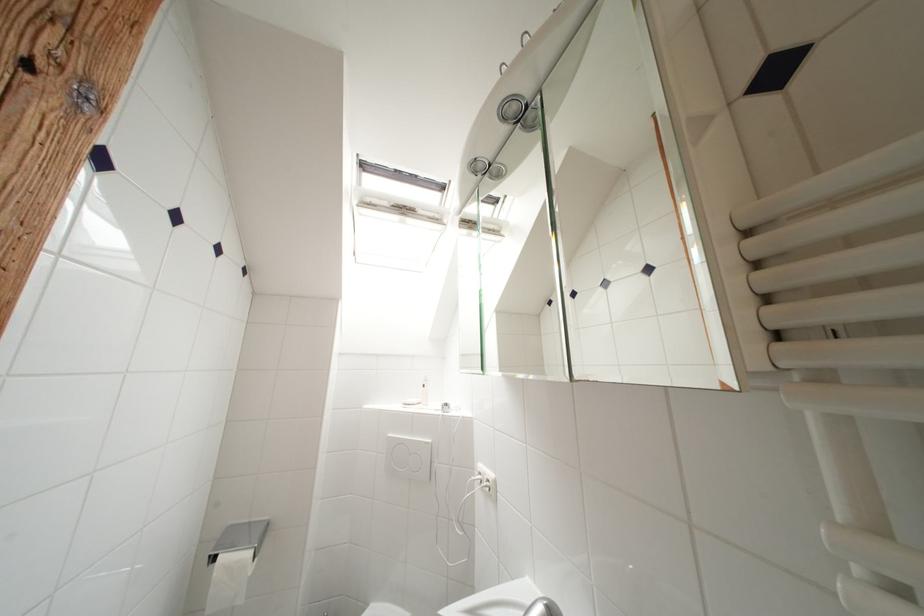
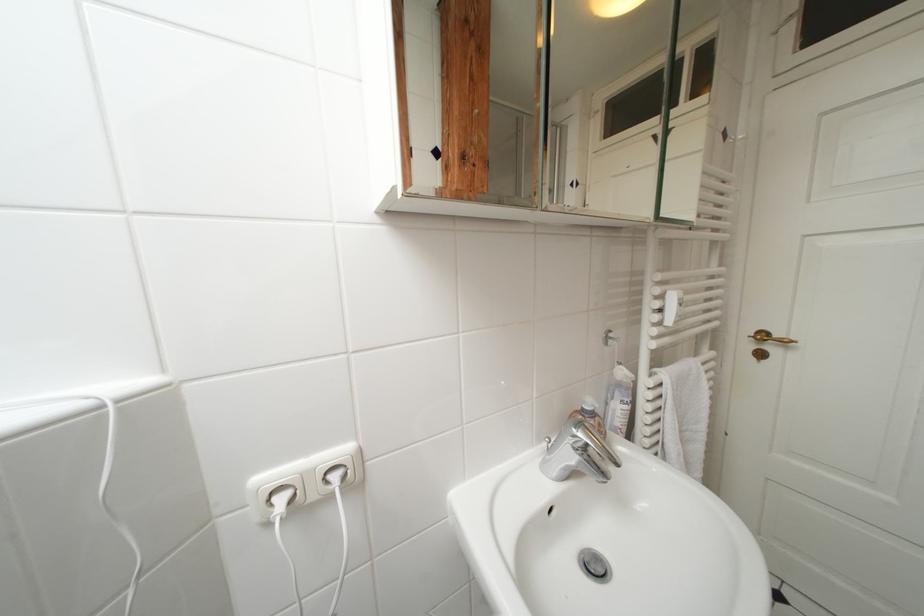
Question: The first image is from the beginning of the video and the second image is from the end. How did the camera likely rotate when shooting the video?

Choices:
 (A) Left
 (B) Right
 (C) Up
 (D) Down

Answer: (B)